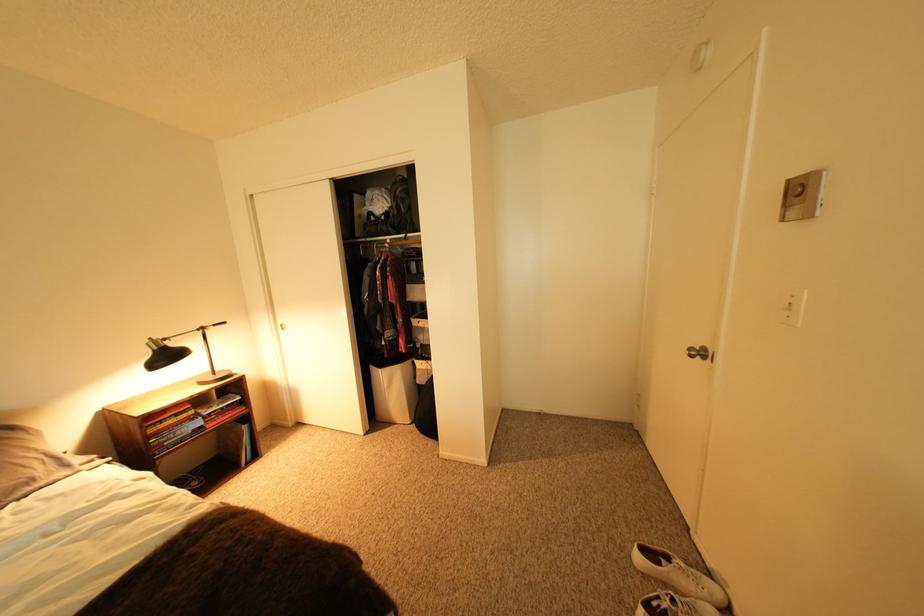
What do you see at coordinates (794, 308) in the screenshot?
I see `the white light switch` at bounding box center [794, 308].